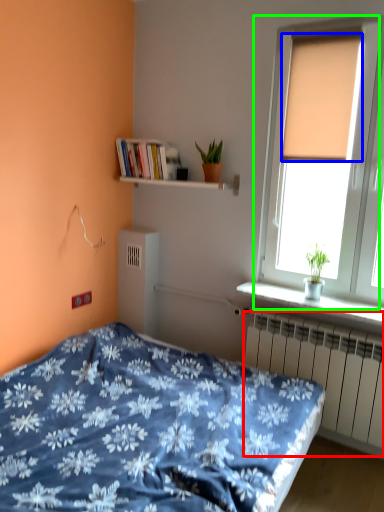
Question: Which object is positioned closest to radiator (highlighted by a red box)? Select from curtain (highlighted by a blue box) and window (highlighted by a green box).

Choices:
 (A) curtain
 (B) window

Answer: (B)